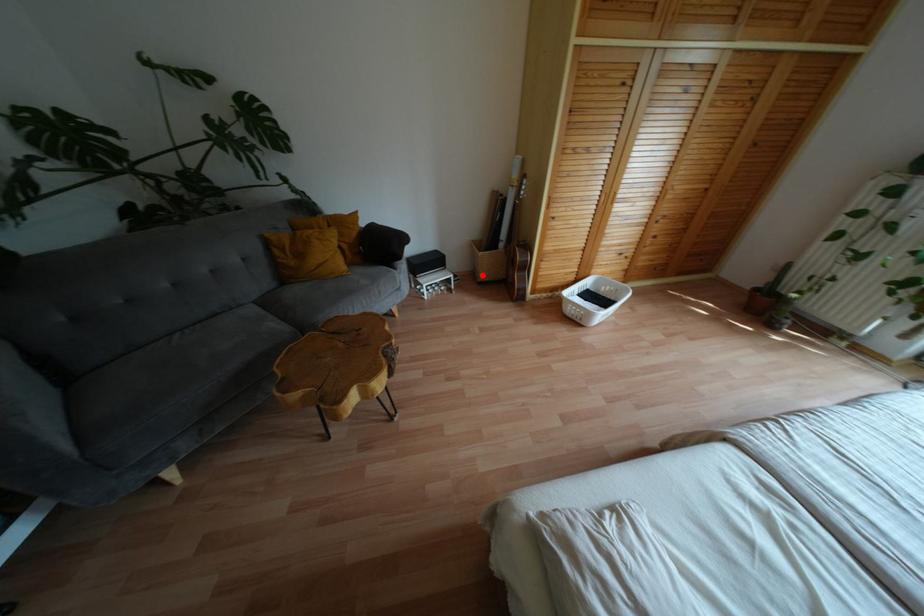
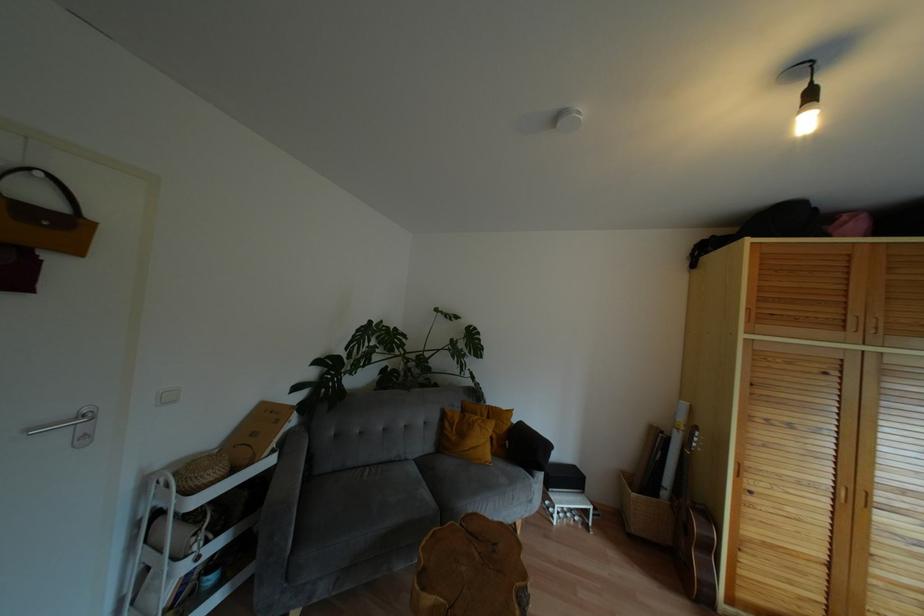
Question: I am providing you with two images of the same scene from different viewpoints. A red point is shown in image1. For the corresponding object point in image2, is it positioned nearer or farther from the camera?

Choices:
 (A) Nearer
 (B) Farther

Answer: (B)